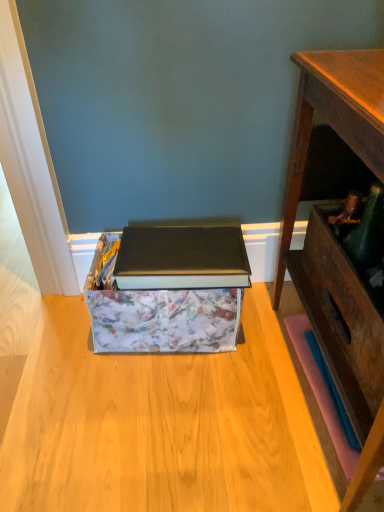
Find the location of `vacant area to the left of floral-patterned cardboard box at center`. vacant area to the left of floral-patterned cardboard box at center is located at coordinates (49, 349).